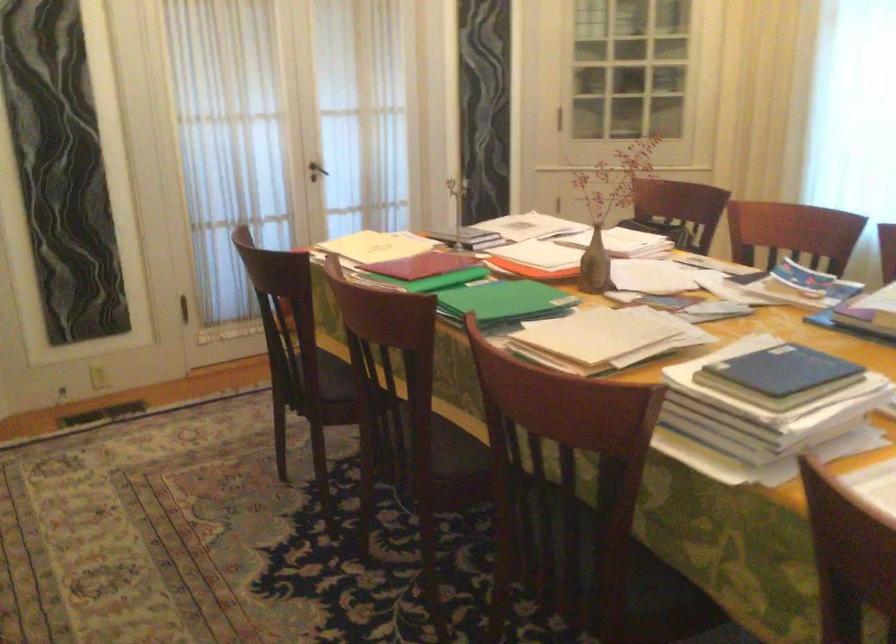
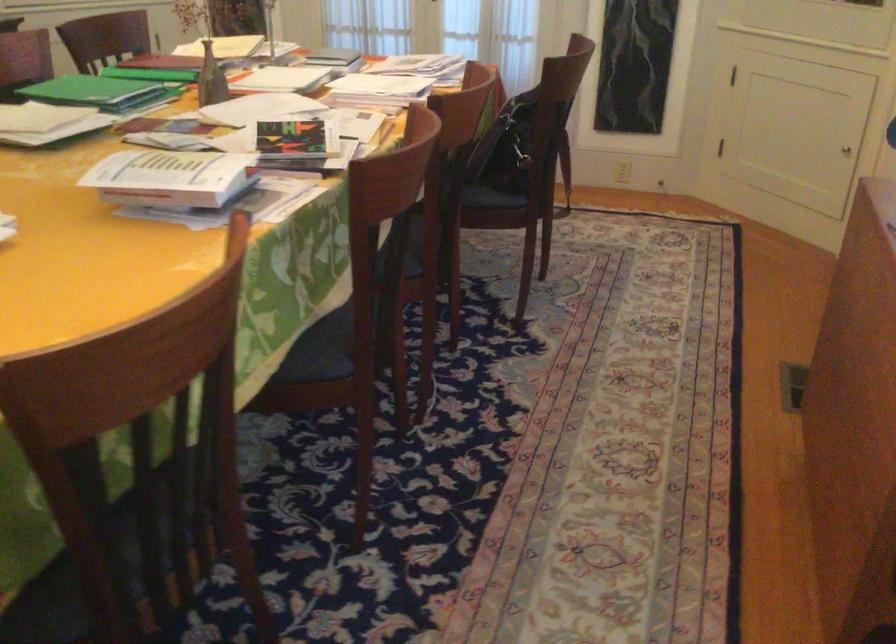
The point at [591,266] is marked in the first image. Where is the corresponding point in the second image?

(211, 79)